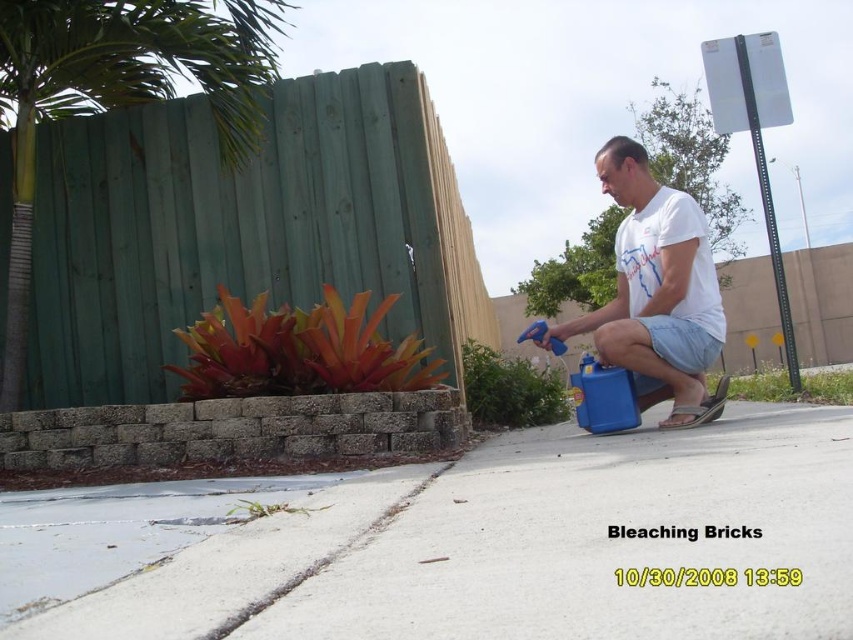
Question: Can you confirm if white concrete pavement at center is positioned below green wood palm tree at upper left?

Choices:
 (A) no
 (B) yes

Answer: (B)

Question: Does green wood palm tree at upper left have a greater width compared to white matte shirt at center?

Choices:
 (A) no
 (B) yes

Answer: (B)

Question: Is green wood palm tree at upper left to the right of white matte shirt at center from the viewer's perspective?

Choices:
 (A) yes
 (B) no

Answer: (B)

Question: Based on their relative distances, which object is farther from the white concrete pavement at center?

Choices:
 (A) green wood palm tree at upper left
 (B) white matte shirt at center

Answer: (A)

Question: Which object is the closest to the white concrete pavement at center?

Choices:
 (A) white matte shirt at center
 (B) green wood palm tree at upper left

Answer: (A)

Question: Which of these objects is positioned closest to the white concrete pavement at center?

Choices:
 (A) white matte shirt at center
 (B) green wood palm tree at upper left

Answer: (A)